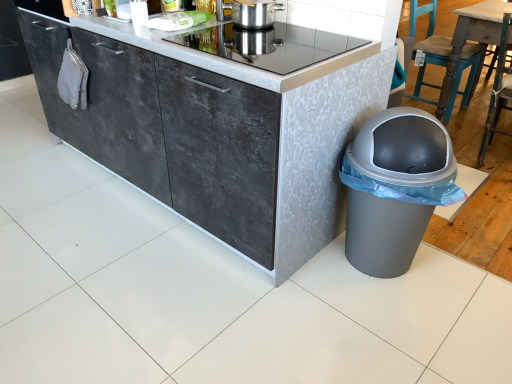
Question: Is metallic glass cooktop at center at the left side of gray plastic trash can at lower right?

Choices:
 (A) yes
 (B) no

Answer: (A)

Question: Could gray plastic trash can at lower right be considered to be inside metallic glass cooktop at center?

Choices:
 (A) yes
 (B) no

Answer: (B)

Question: Is metallic glass cooktop at center with gray plastic trash can at lower right?

Choices:
 (A) yes
 (B) no

Answer: (B)

Question: Does metallic glass cooktop at center have a smaller size compared to gray plastic trash can at lower right?

Choices:
 (A) yes
 (B) no

Answer: (A)

Question: From the image's perspective, does metallic glass cooktop at center appear lower than gray plastic trash can at lower right?

Choices:
 (A) no
 (B) yes

Answer: (A)

Question: Does metallic glass cooktop at center appear on the right side of gray plastic trash can at lower right?

Choices:
 (A) no
 (B) yes

Answer: (A)

Question: Is gray plastic trash can at lower right taller than metallic glass cooktop at center?

Choices:
 (A) no
 (B) yes

Answer: (B)

Question: Does gray plastic trash can at lower right have a lesser height compared to metallic glass cooktop at center?

Choices:
 (A) no
 (B) yes

Answer: (A)

Question: Can you confirm if gray plastic trash can at lower right is thinner than metallic glass cooktop at center?

Choices:
 (A) no
 (B) yes

Answer: (B)

Question: Is gray plastic trash can at lower right looking in the opposite direction of metallic glass cooktop at center?

Choices:
 (A) no
 (B) yes

Answer: (A)

Question: Is metallic glass cooktop at center completely or partially inside gray plastic trash can at lower right?

Choices:
 (A) yes
 (B) no

Answer: (B)

Question: Is gray plastic trash can at lower right at the right side of metallic glass cooktop at center?

Choices:
 (A) yes
 (B) no

Answer: (A)

Question: From a real-world perspective, does stainless steel pot at upper center sit lower than wooden chair at right, the 2th chair from the back?

Choices:
 (A) yes
 (B) no

Answer: (B)